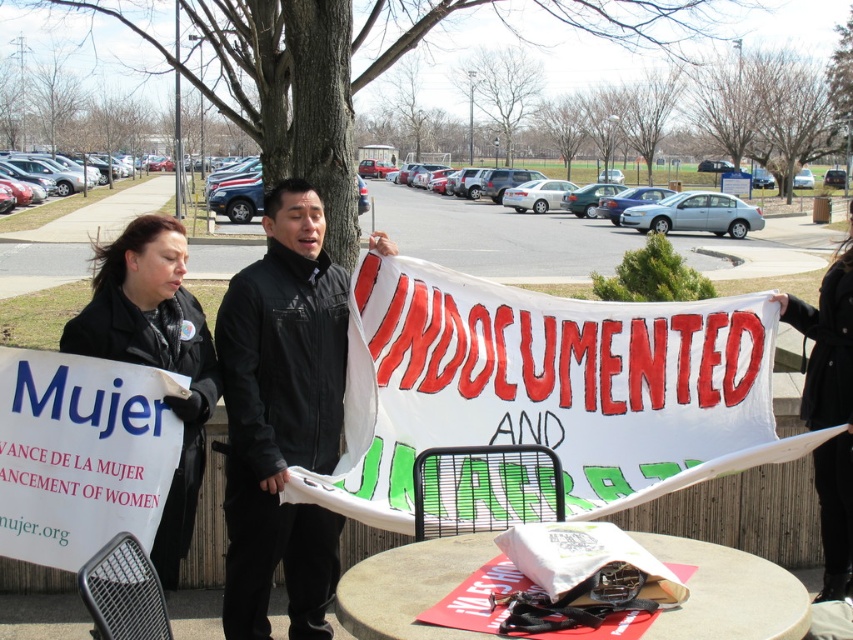
Question: Can you confirm if black matte jacket at center is positioned to the right of black fabric sign at right?

Choices:
 (A) no
 (B) yes

Answer: (A)

Question: Which is farther from the black fabric sign at right?

Choices:
 (A) black leather jacket at lower left
 (B) black matte jacket at center

Answer: (A)

Question: Which point is farther from the camera taking this photo?

Choices:
 (A) click(x=175, y=269)
 (B) click(x=276, y=234)
 (C) click(x=805, y=305)

Answer: (C)

Question: Does black matte jacket at center appear on the left side of black leather jacket at lower left?

Choices:
 (A) no
 (B) yes

Answer: (A)

Question: Which point is closer to the camera?

Choices:
 (A) black leather jacket at lower left
 (B) black fabric sign at right

Answer: (A)

Question: Can you confirm if black leather jacket at lower left is positioned to the right of black fabric sign at right?

Choices:
 (A) yes
 (B) no

Answer: (B)